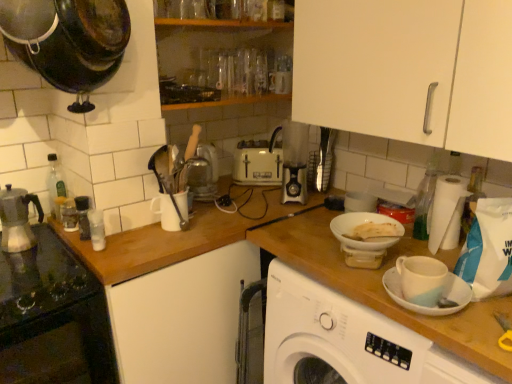
Question: Is black glass cooktop at left in front of or behind clear plastic bottle at right, which is the fourth bottle in left-to-right order, in the image?

Choices:
 (A) front
 (B) behind

Answer: (A)

Question: From the image's perspective, is black glass cooktop at left located above or below clear plastic bottle at right, the 1th bottle from the right?

Choices:
 (A) below
 (B) above

Answer: (A)

Question: Which of these objects is positioned farthest from the translucent glass coffee machine at center?

Choices:
 (A) clear glass bottle at left, arranged as the 4th bottle when viewed from the right
 (B) black glass cooktop at left
 (C) metallic silver espresso maker at left
 (D) clear plastic bottle at right, the 1th bottle from the right
 (E) clear glass jar at left

Answer: (D)

Question: Considering the real-world distances, which object is closest to the black glass cooktop at left?

Choices:
 (A) black plastic grinder at left, positioned as the 2th bottle in left-to-right order
 (B) clear plastic bottle at right, which is the fourth bottle in left-to-right order
 (C) metallic silver espresso maker at left
 (D) white matte saucer at right
 (E) white matte bottle at left, which is counted as the second bottle, starting from the right

Answer: (E)